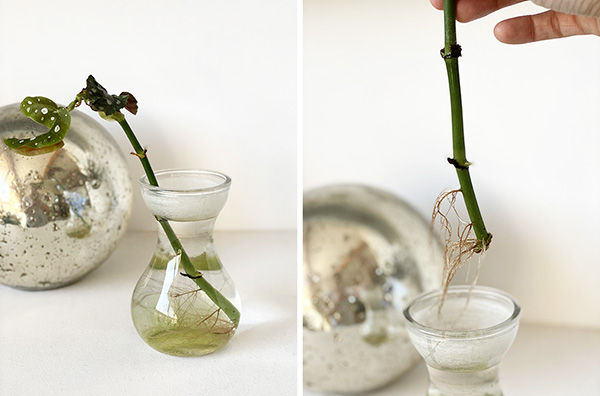
Identify the location of white desk surface. The width and height of the screenshot is (600, 396). (236, 365), (540, 377).